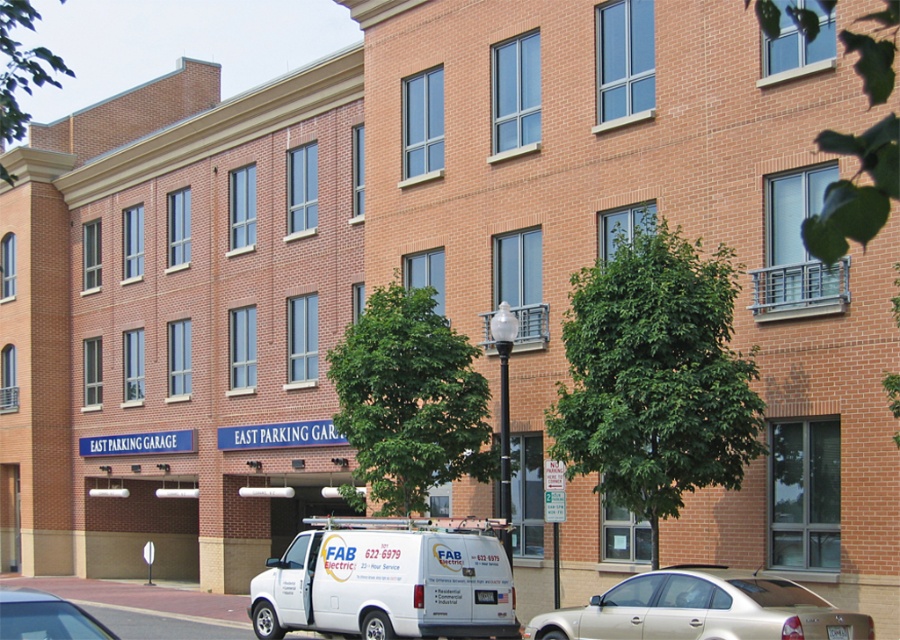
Question: Does white matte van at center appear on the left side of gold metallic sedan at lower center?

Choices:
 (A) yes
 (B) no

Answer: (A)

Question: Which object is the farthest from the white matte van at center?

Choices:
 (A) white matte van at lower left
 (B) gold metallic sedan at lower center

Answer: (B)

Question: Estimate the real-world distances between objects in this image. Which object is farther from the gold metallic sedan at lower center?

Choices:
 (A) white matte van at lower left
 (B) white matte van at center

Answer: (B)

Question: Is white matte van at center bigger than gold metallic sedan at lower center?

Choices:
 (A) yes
 (B) no

Answer: (B)

Question: Does white matte van at center appear over gold metallic sedan at lower center?

Choices:
 (A) yes
 (B) no

Answer: (B)

Question: Which point is farther to the camera?

Choices:
 (A) (806, 604)
 (B) (101, 627)

Answer: (A)